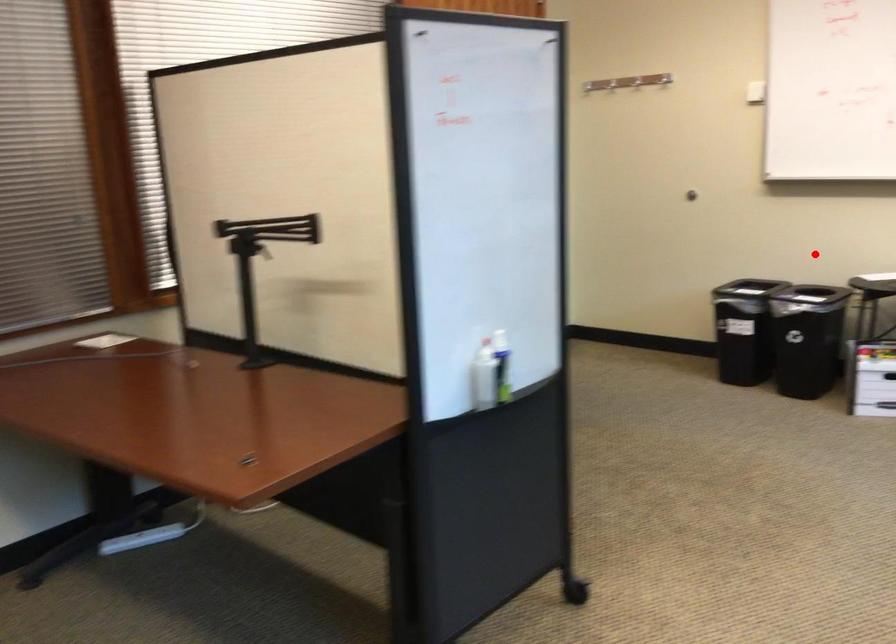
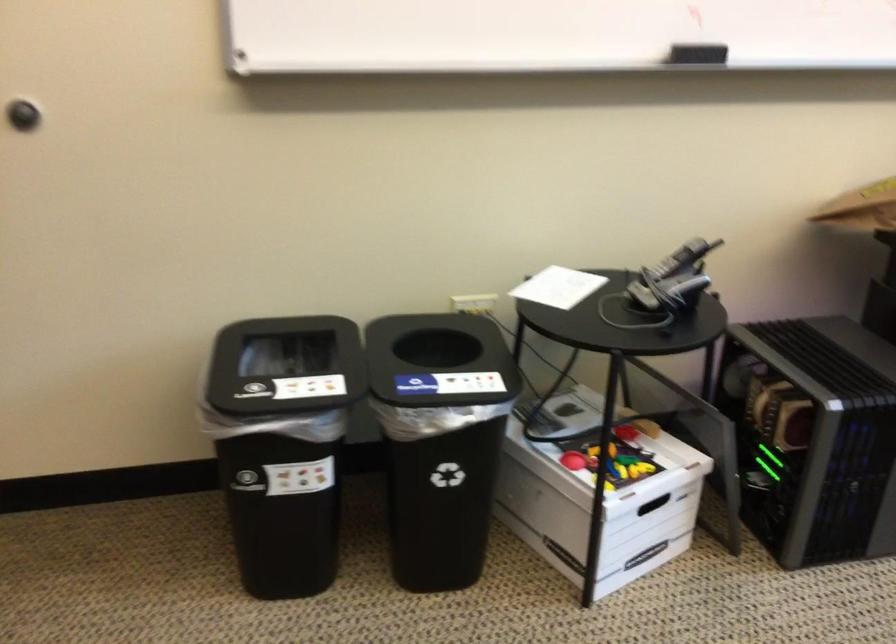
The point at the highlighted location is marked in the first image. Where is the corresponding point in the second image?

(558, 287)